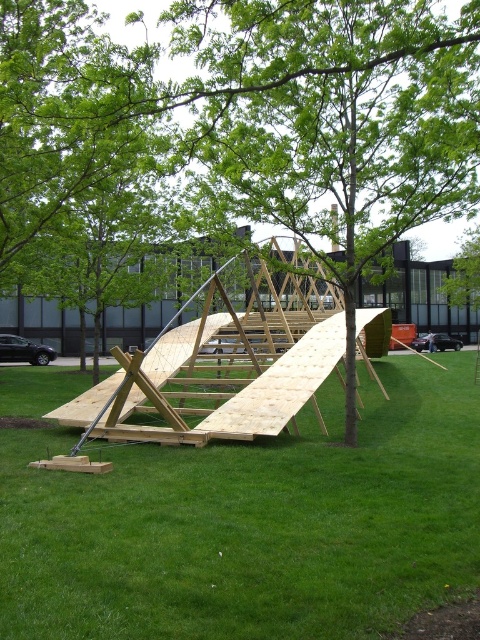
Question: Does green grassy at center have a lesser width compared to green leafy tree at center?

Choices:
 (A) yes
 (B) no

Answer: (A)

Question: Which of the following is the closest to the observer?

Choices:
 (A) pos(14,1)
 (B) pos(169,516)

Answer: (B)

Question: Is green grassy at center below green leafy tree at center?

Choices:
 (A) yes
 (B) no

Answer: (A)

Question: Which object is closer to the camera taking this photo?

Choices:
 (A) green leafy tree at center
 (B) green grassy at center

Answer: (B)

Question: Does green grassy at center have a smaller size compared to green leafy tree at center?

Choices:
 (A) yes
 (B) no

Answer: (A)